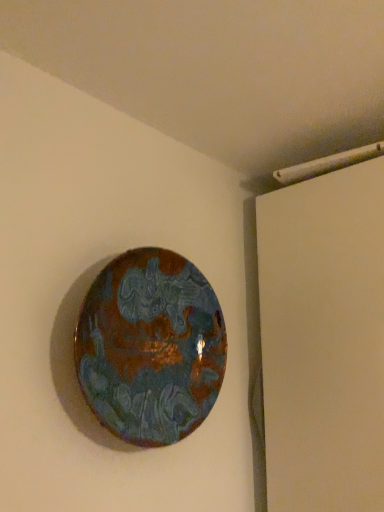
Where is `rustic ceramic plate at center`? rustic ceramic plate at center is located at coordinates (151, 347).

In order to face rustic ceramic plate at center, should I rotate leftwards or rightwards?

You should look left and rotate roughly 5.069 degrees.

What do you see at coordinates (151, 347) in the screenshot?
I see `rustic ceramic plate at center` at bounding box center [151, 347].

Identify the location of rustic ceramic plate at center. Image resolution: width=384 pixels, height=512 pixels. [x=151, y=347].